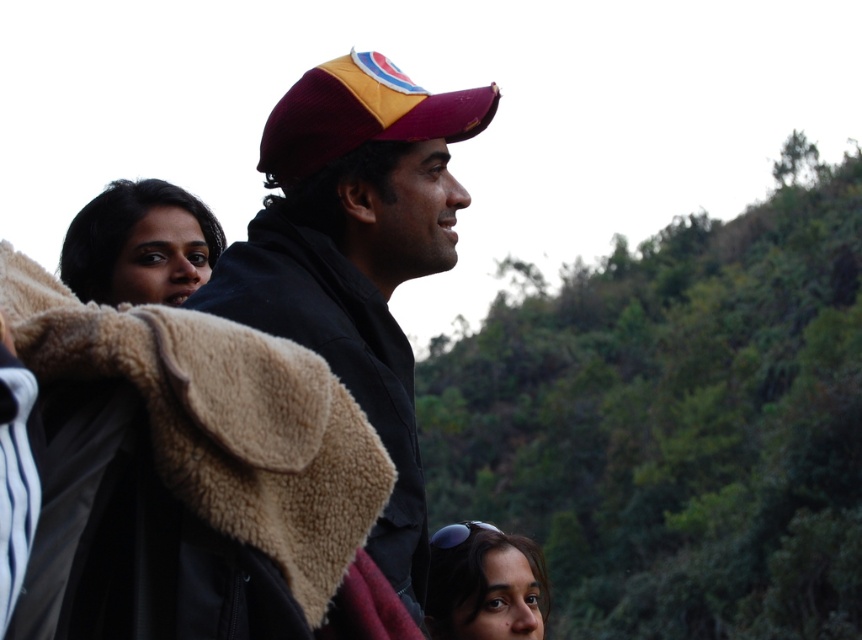
Question: Which point is closer to the camera taking this photo?

Choices:
 (A) (470, 560)
 (B) (328, 440)
 (C) (378, 81)

Answer: (B)

Question: Can you confirm if maroon fabric cap at center is wider than maroon ribbed baseball cap at upper center?

Choices:
 (A) yes
 (B) no

Answer: (A)

Question: Estimate the real-world distances between objects in this image. Which object is closer to the maroon ribbed baseball cap at upper center?

Choices:
 (A) maroon fabric cap at center
 (B) beige fleece jacket at center

Answer: (A)

Question: Which of the following is the farthest from the observer?

Choices:
 (A) (313, 180)
 (B) (263, 170)

Answer: (B)

Question: Does maroon fabric cap at center appear under maroon ribbed baseball cap at upper center?

Choices:
 (A) yes
 (B) no

Answer: (A)

Question: In this image, where is maroon fabric cap at center located relative to smooth brown hair at lower center?

Choices:
 (A) right
 (B) left

Answer: (B)